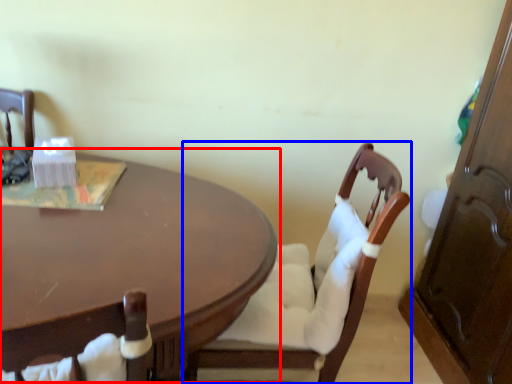
Question: Which object is further to the camera taking this photo, coffee table (highlighted by a red box) or chair (highlighted by a blue box)?

Choices:
 (A) coffee table
 (B) chair

Answer: (B)